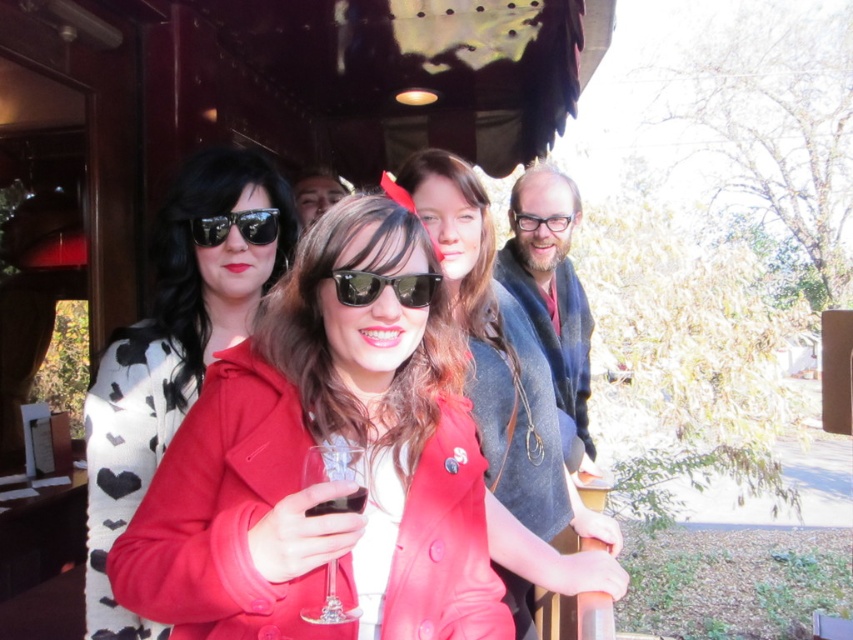
Looking at this image, you are a photographer standing 1.5 meters away from the subject. You want to take a closeup shot of the matte black sunglasses at left without moving closer. Is it possible?

The matte black sunglasses at left is 1.51 meters away from the viewer. Since you are already 1.5 meters away, you cannot move closer to take the closeup shot without exceeding your current distance.

You are a photographer trying to capture a candid shot of the matte red coat at center without including the matte black sunglasses at left in the frame. Based on their positions, is this possible?

The matte black sunglasses at left is to the left of the matte red coat at center, so if you position yourself to the right side of the matte red coat at center and frame the shot to exclude the left side, you can capture the matte red coat at center without including the matte black sunglasses at left.